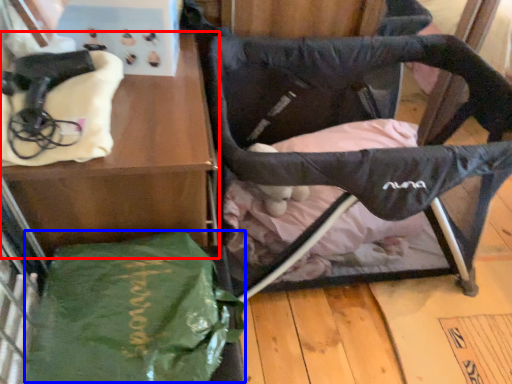
Question: Among these objects, which one is nearest to the camera, furniture (highlighted by a red box) or tote bag (highlighted by a blue box)?

Choices:
 (A) furniture
 (B) tote bag

Answer: (B)